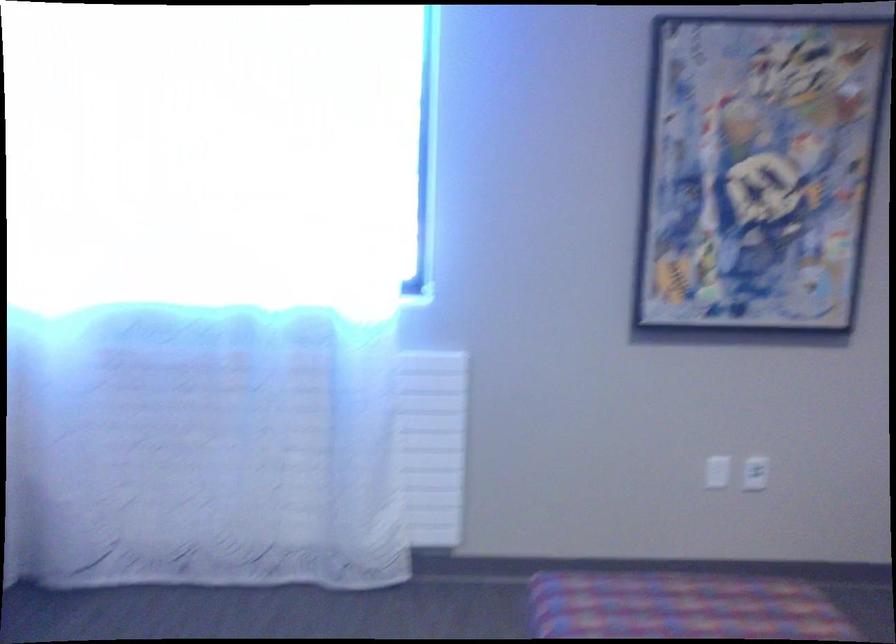
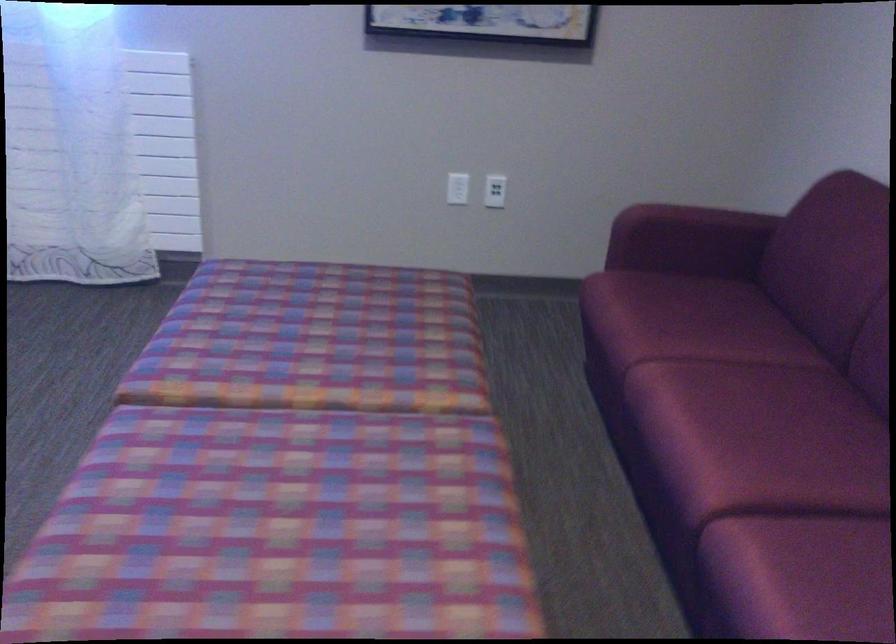
Where in the second image is the point corresponding to point 720,474 from the first image?

(458, 187)